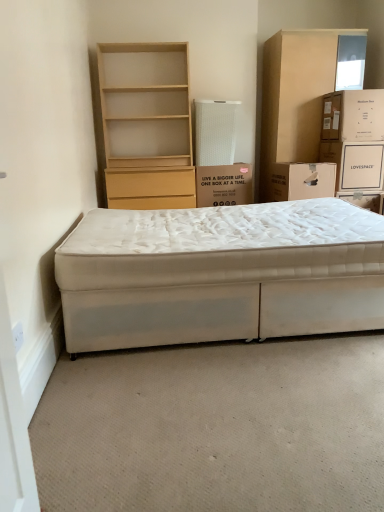
Question: Is beige cardboard cabinet at upper right inside white cardboard box at upper right?

Choices:
 (A) yes
 (B) no

Answer: (B)

Question: Can we say white cardboard box at upper right lies outside beige cardboard cabinet at upper right?

Choices:
 (A) no
 (B) yes

Answer: (B)

Question: Is white cardboard box at upper right looking in the opposite direction of beige cardboard cabinet at upper right?

Choices:
 (A) no
 (B) yes

Answer: (B)

Question: Considering the relative positions of white cardboard box at upper right and beige cardboard cabinet at upper right in the image provided, is white cardboard box at upper right to the left of beige cardboard cabinet at upper right from the viewer's perspective?

Choices:
 (A) no
 (B) yes

Answer: (A)

Question: Is white cardboard box at upper right wider than beige cardboard cabinet at upper right?

Choices:
 (A) yes
 (B) no

Answer: (B)

Question: Would you say white fabric bed at lower center is to the left or to the right of white cardboard box at upper right in the picture?

Choices:
 (A) left
 (B) right

Answer: (A)

Question: Looking at the image, does white fabric bed at lower center seem bigger or smaller compared to white cardboard box at upper right?

Choices:
 (A) small
 (B) big

Answer: (B)

Question: In terms of height, does white fabric bed at lower center look taller or shorter compared to white cardboard box at upper right?

Choices:
 (A) short
 (B) tall

Answer: (B)

Question: Does point (243, 296) appear closer or farther from the camera than point (367, 178)?

Choices:
 (A) closer
 (B) farther

Answer: (A)

Question: Does point (142, 221) appear closer or farther from the camera than point (122, 141)?

Choices:
 (A) closer
 (B) farther

Answer: (A)

Question: Relative to light wood/finely finished bookshelf at upper left, is white fabric bed at lower center in front or behind?

Choices:
 (A) behind
 (B) front

Answer: (B)

Question: Considering the positions of white fabric bed at lower center and light wood/finely finished bookshelf at upper left in the image, is white fabric bed at lower center taller or shorter than light wood/finely finished bookshelf at upper left?

Choices:
 (A) tall
 (B) short

Answer: (B)

Question: Is white fabric bed at lower center to the left or to the right of light wood/finely finished bookshelf at upper left in the image?

Choices:
 (A) right
 (B) left

Answer: (A)

Question: Considering their positions, is white cardboard box at upper right located in front of or behind white cardboard box at center, the third box when ordered from right to left?

Choices:
 (A) front
 (B) behind

Answer: (A)

Question: Is point (340, 189) positioned closer to the camera than point (235, 164)?

Choices:
 (A) farther
 (B) closer

Answer: (B)